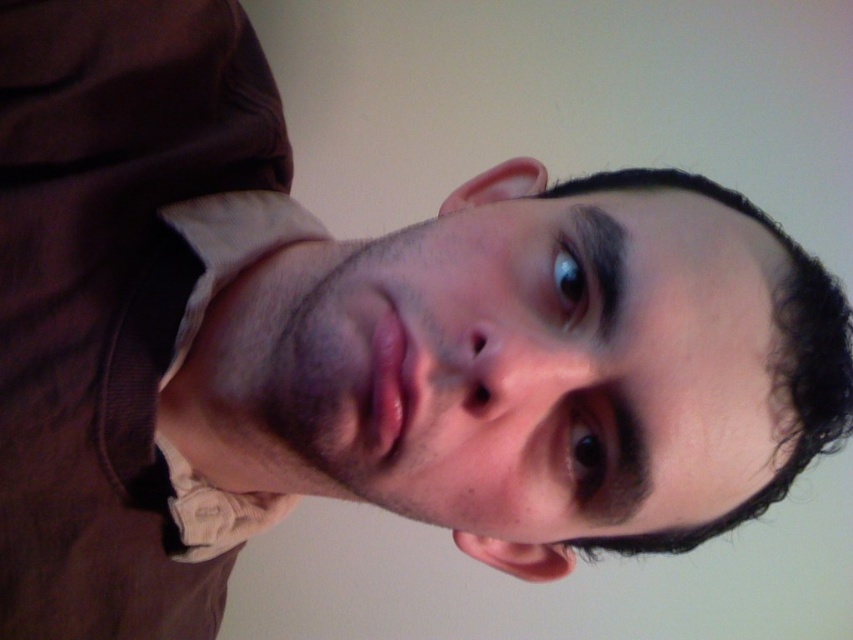
Question: Can you confirm if smooth skin face at center is positioned to the right of white cotton dress shirt at left?

Choices:
 (A) yes
 (B) no

Answer: (A)

Question: Is smooth skin face at center to the right of white cotton dress shirt at left from the viewer's perspective?

Choices:
 (A) yes
 (B) no

Answer: (A)

Question: Among these objects, which one is farthest from the camera?

Choices:
 (A) white cotton dress shirt at left
 (B) smooth skin face at center

Answer: (A)

Question: Does smooth skin face at center lie behind white cotton dress shirt at left?

Choices:
 (A) no
 (B) yes

Answer: (A)

Question: Which point is closer to the camera taking this photo?

Choices:
 (A) (228, 189)
 (B) (708, 307)

Answer: (B)